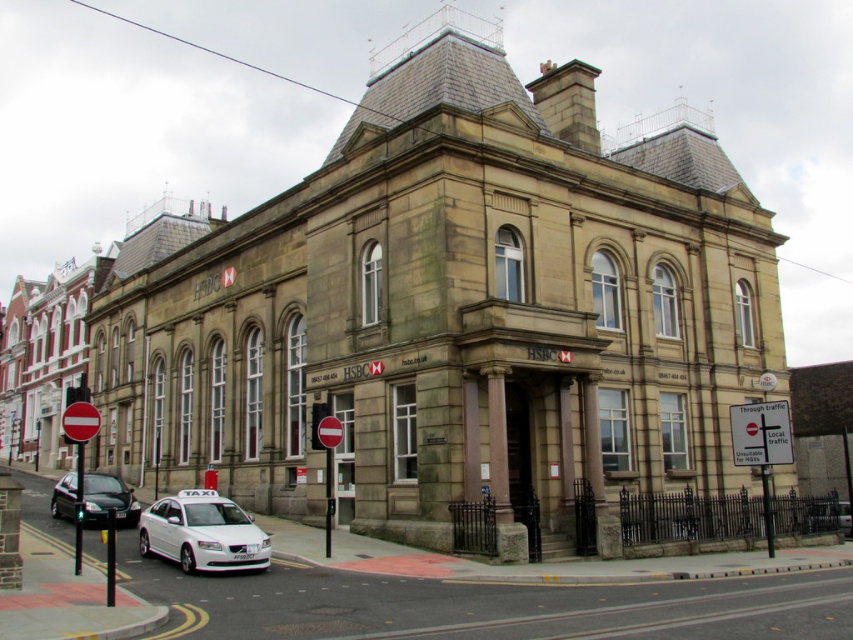
Question: Is white glossy taxi at center positioned in front of shiny black sedan at lower left?

Choices:
 (A) no
 (B) yes

Answer: (B)

Question: Is white glossy taxi at center smaller than shiny black sedan at lower left?

Choices:
 (A) yes
 (B) no

Answer: (A)

Question: Among these objects, which one is nearest to the camera?

Choices:
 (A) white plastic sign at lower right
 (B) white glossy taxi at center

Answer: (B)

Question: Which object is the farthest from the white plastic sign at lower right?

Choices:
 (A) shiny black sedan at lower left
 (B) white glossy taxi at center

Answer: (A)

Question: Which object is positioned closest to the white plastic sign at lower right?

Choices:
 (A) white glossy taxi at center
 (B) shiny black sedan at lower left

Answer: (A)

Question: Can you confirm if white glossy taxi at center is wider than shiny black sedan at lower left?

Choices:
 (A) no
 (B) yes

Answer: (A)